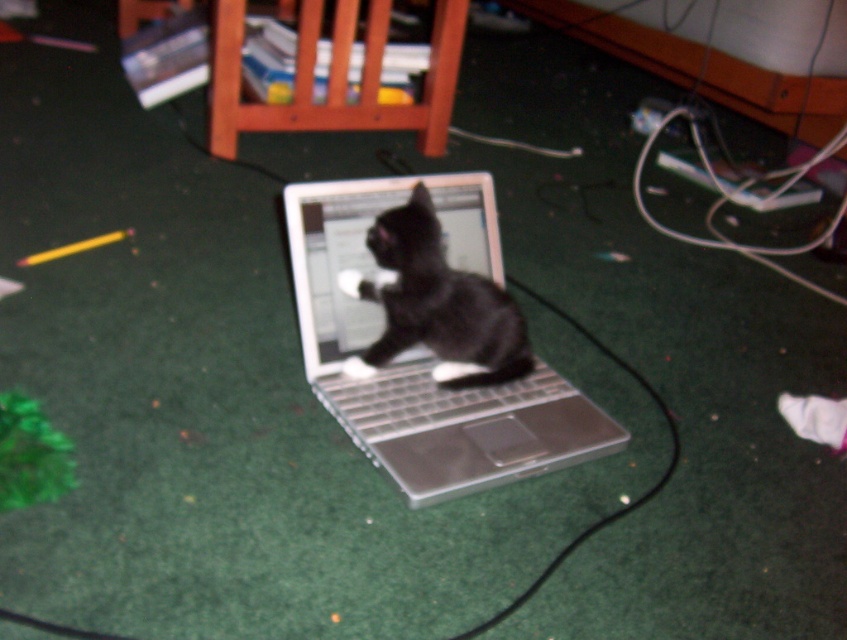
Question: Which object is positioned farthest from the silver metallic laptop at center?

Choices:
 (A) silver metallic keyboard at center
 (B) black matte fur cat at center

Answer: (B)

Question: Is silver metallic laptop at center below black matte fur cat at center?

Choices:
 (A) no
 (B) yes

Answer: (B)

Question: Based on their relative distances, which object is nearer to the silver metallic keyboard at center?

Choices:
 (A) silver metallic laptop at center
 (B) black matte fur cat at center

Answer: (A)

Question: Which point is closer to the camera taking this photo?

Choices:
 (A) (382, 390)
 (B) (396, 337)
 (C) (390, 451)

Answer: (C)

Question: Can you confirm if black matte fur cat at center is positioned to the right of silver metallic keyboard at center?

Choices:
 (A) no
 (B) yes

Answer: (A)

Question: Is black matte fur cat at center smaller than silver metallic keyboard at center?

Choices:
 (A) no
 (B) yes

Answer: (A)